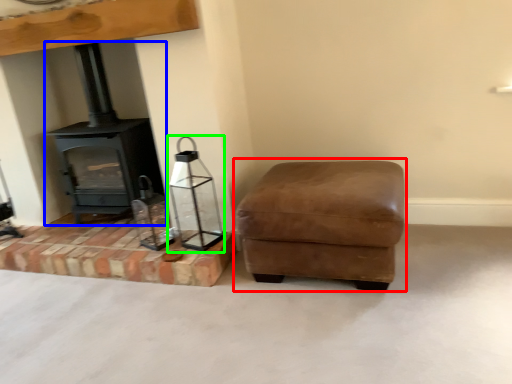
Question: Which object is the closest to the rocking chair (highlighted by a red box)? Choose among these: wood burning stove (highlighted by a blue box) or candle holder (highlighted by a green box).

Choices:
 (A) wood burning stove
 (B) candle holder

Answer: (B)